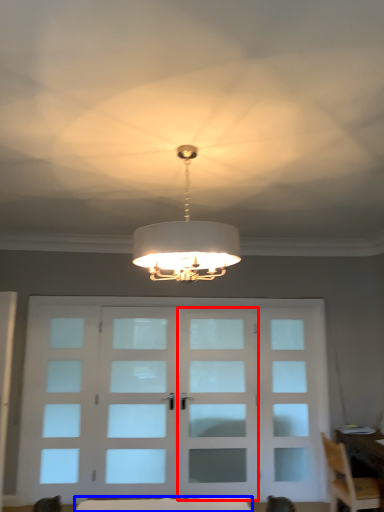
Question: Which object appears farthest to the camera in this image, screen door (highlighted by a red box) or furniture (highlighted by a blue box)?

Choices:
 (A) screen door
 (B) furniture

Answer: (A)